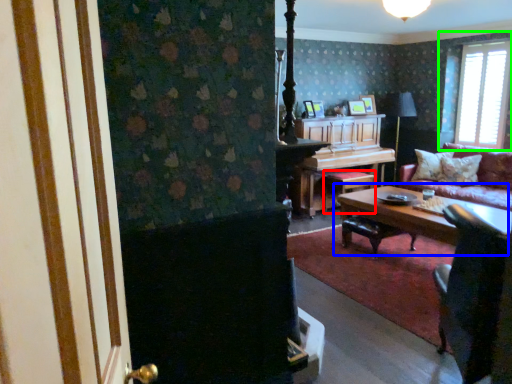
Question: Estimate the real-world distances between objects in this image. Which object is farther from stool (highlighted by a red box), coffee table (highlighted by a blue box) or window (highlighted by a green box)?

Choices:
 (A) coffee table
 (B) window

Answer: (B)